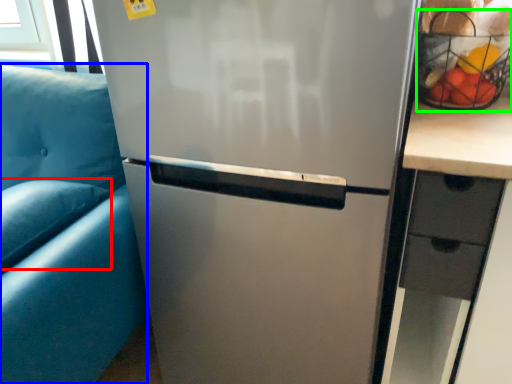
Question: Estimate the real-world distances between objects in this image. Which object is farther from pillow (highlighted by a red box), armchair (highlighted by a blue box) or basket (highlighted by a green box)?

Choices:
 (A) armchair
 (B) basket

Answer: (B)